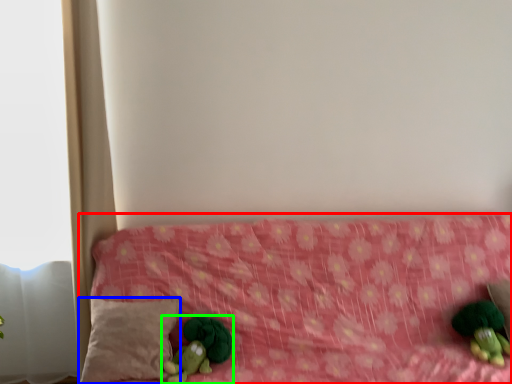
Question: Which object is positioned closest to furniture (highlighted by a red box)? Select from pillow (highlighted by a blue box) and toy (highlighted by a green box).

Choices:
 (A) pillow
 (B) toy

Answer: (A)